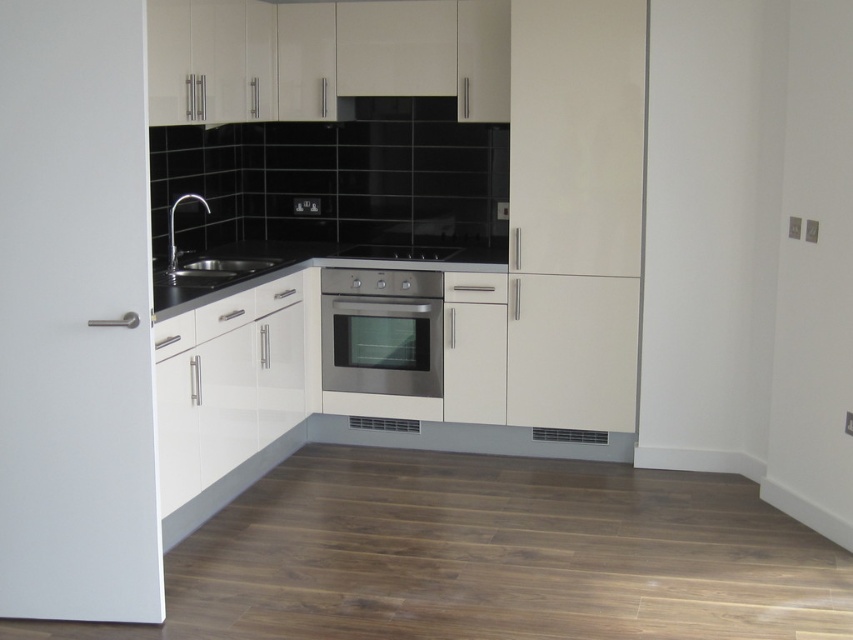
Does black glossy countertop at center appear on the right side of stainless steel stove at center?

Incorrect, black glossy countertop at center is not on the right side of stainless steel stove at center.

Is black glossy countertop at center wider than stainless steel stove at center?

Correct, the width of black glossy countertop at center exceeds that of stainless steel stove at center.

Is point (219, 259) positioned behind point (403, 241)?

No.

This screenshot has height=640, width=853. I want to click on black glossy countertop at center, so click(305, 266).

Is stainless steel oven at center shorter than black glossy countertop at center?

No, stainless steel oven at center is not shorter than black glossy countertop at center.

Is stainless steel oven at center further to the viewer compared to black glossy countertop at center?

Yes.

Is point (320, 301) farther from camera compared to point (430, 259)?

Yes, point (320, 301) is farther from viewer.

Locate an element on the screen. stainless steel oven at center is located at coordinates (381, 332).

Who is positioned more to the left, stainless steel oven at center or stainless steel stove at center?

From the viewer's perspective, stainless steel oven at center appears more on the left side.

Can you confirm if stainless steel oven at center is wider than stainless steel stove at center?

In fact, stainless steel oven at center might be narrower than stainless steel stove at center.

What do you see at coordinates (381, 332) in the screenshot? The height and width of the screenshot is (640, 853). I see `stainless steel oven at center` at bounding box center [381, 332].

Locate an element on the screen. The height and width of the screenshot is (640, 853). stainless steel oven at center is located at coordinates (381, 332).